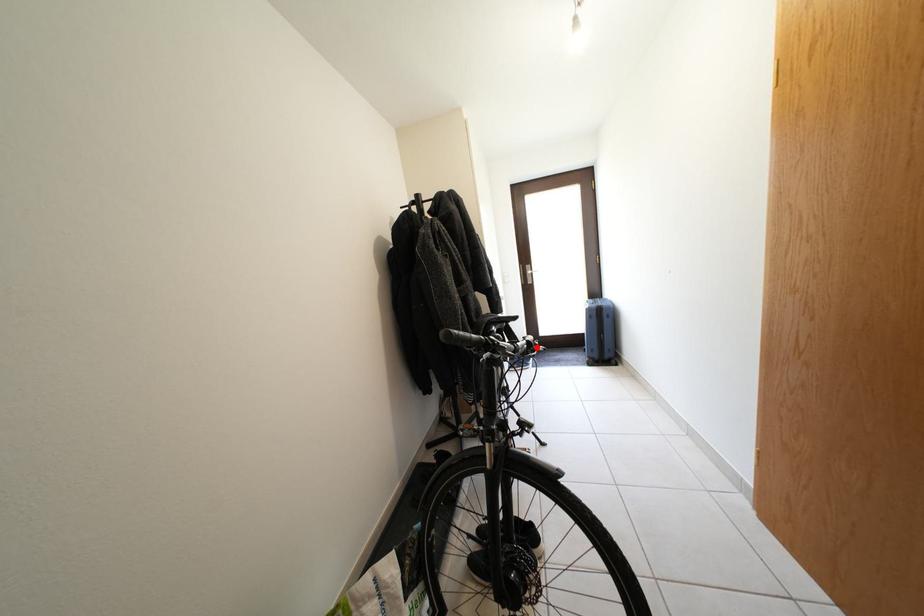
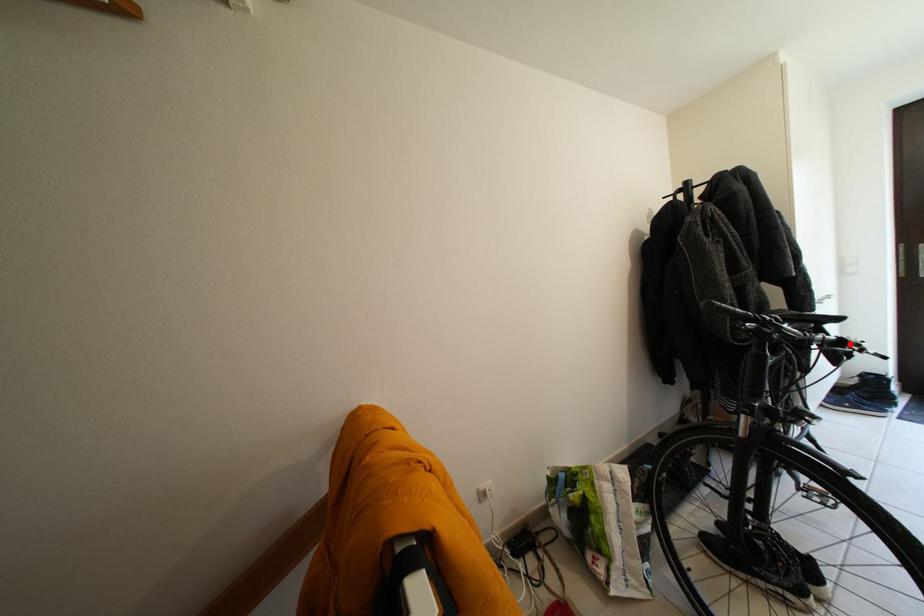
I am providing you with two images of the same scene from different viewpoints. A red point is marked on the first image and another point is marked on the second image. Is the red point in image1 aligned with the point shown in image2?

Yes